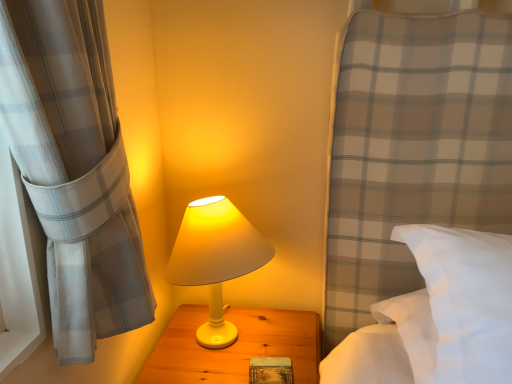
Identify the location of vacant space underneath white matte lamp at center (from a real-world perspective). (229, 343).